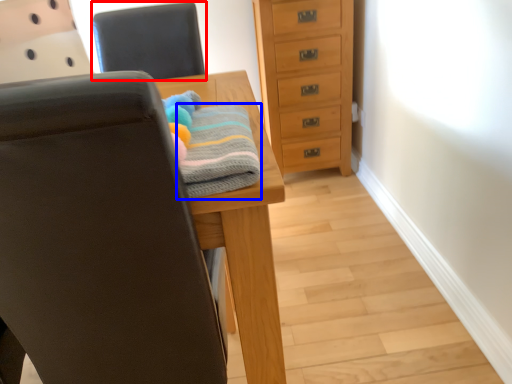
Question: Which object appears farthest to the camera in this image, chair (highlighted by a red box) or bath towel (highlighted by a blue box)?

Choices:
 (A) chair
 (B) bath towel

Answer: (A)